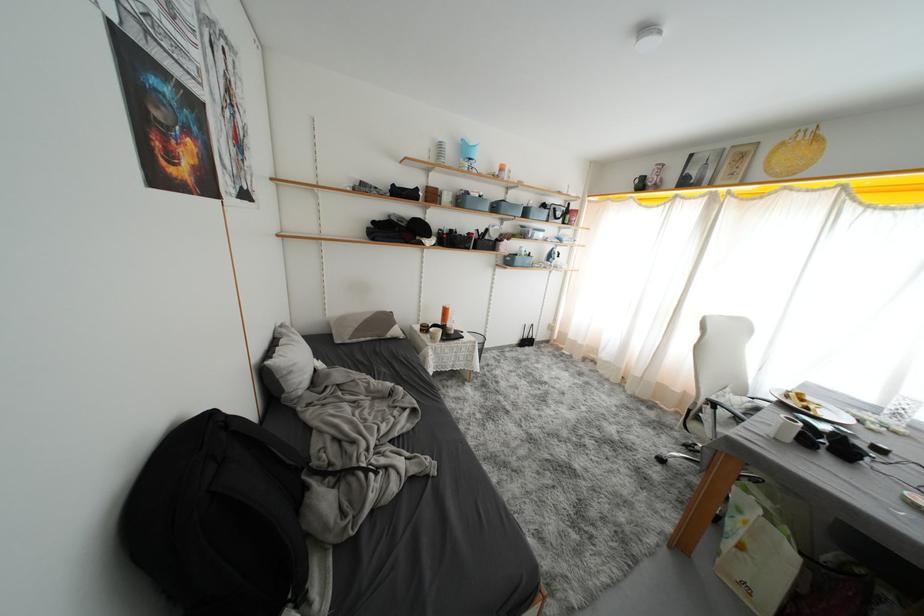
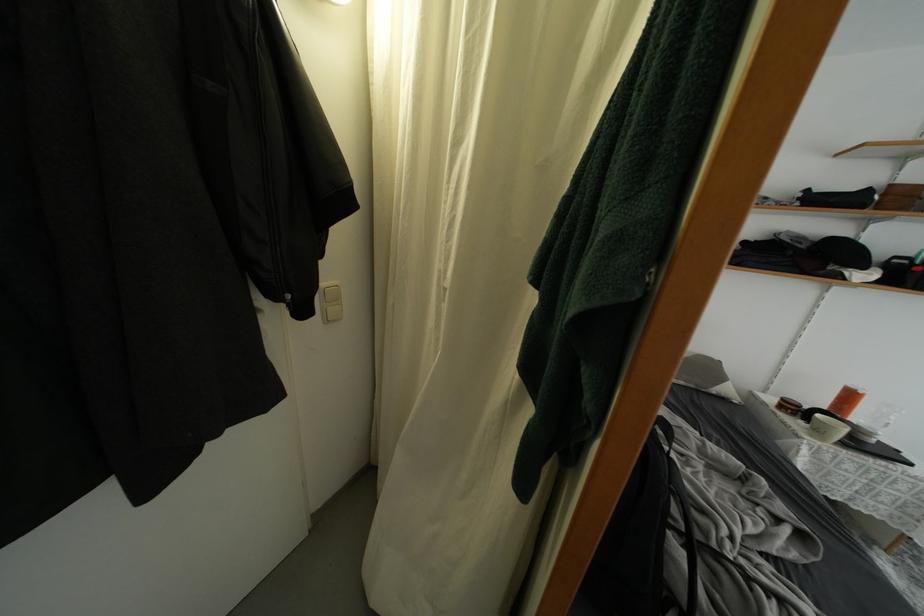
The point at (407, 392) is marked in the first image. Where is the corresponding point in the second image?

(769, 485)